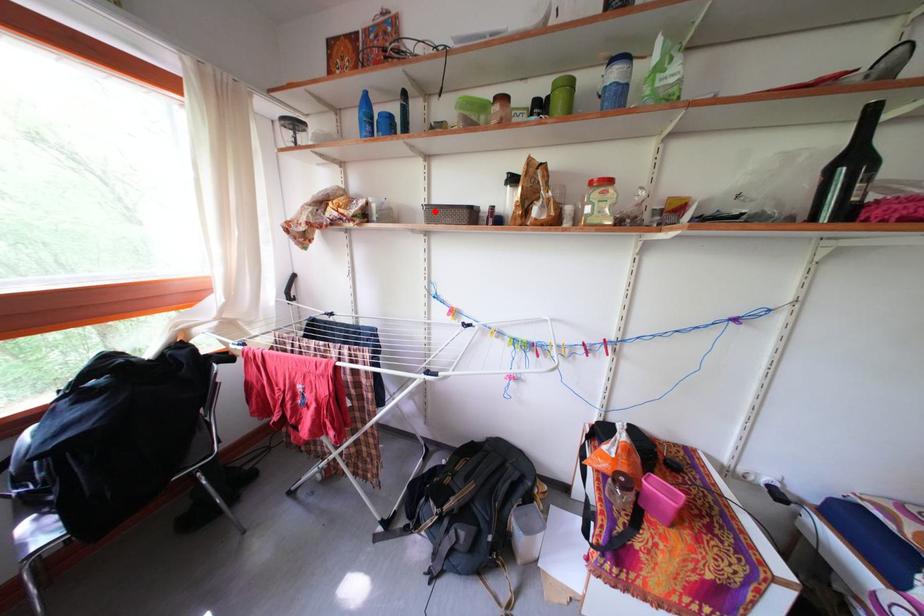
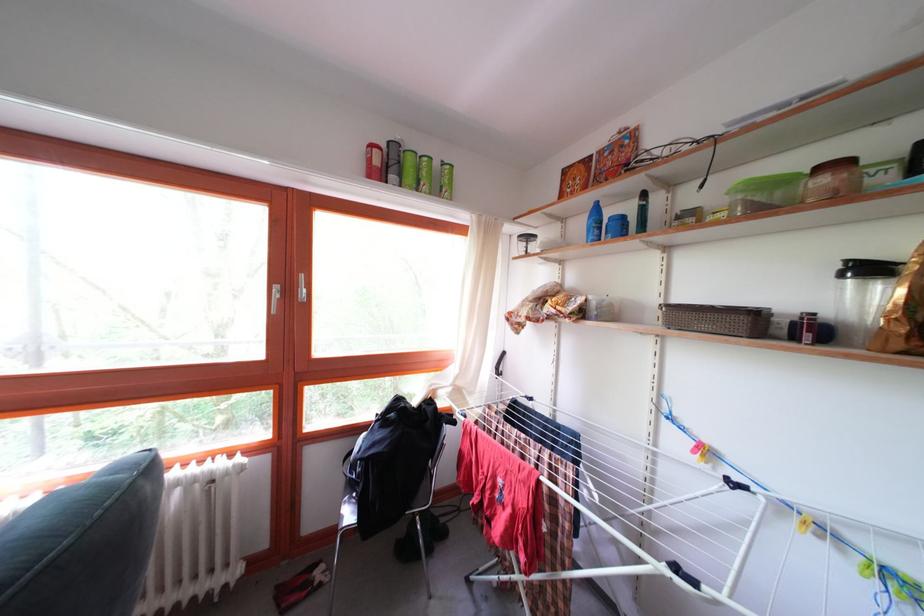
Locate, in the second image, the point that corresponds to the highlighted location in the first image.

(675, 312)